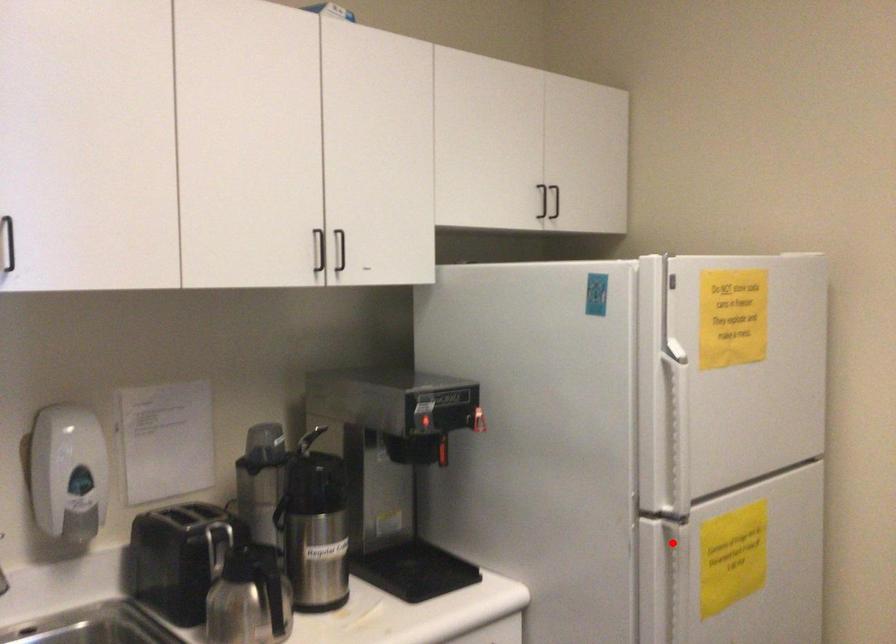
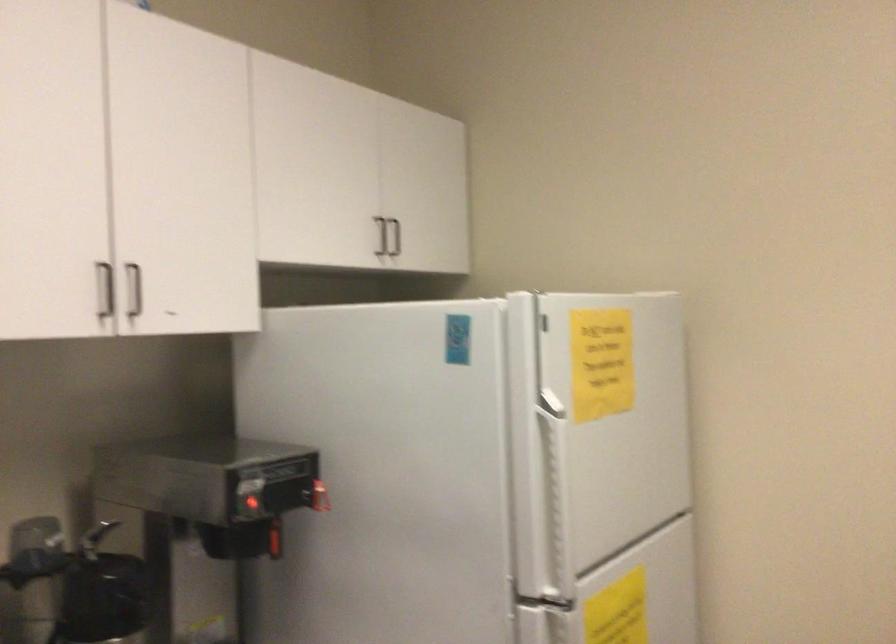
Where in the second image is the point corresponding to the highlighted location from the first image?

(558, 627)